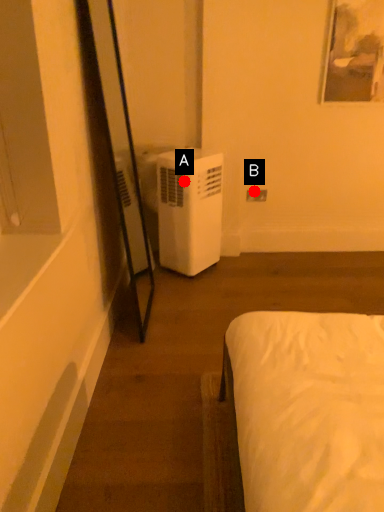
Question: Two points are circled on the image, labeled by A and B beside each circle. Among these points, which one is nearest to the camera?

Choices:
 (A) A is closer
 (B) B is closer

Answer: (A)